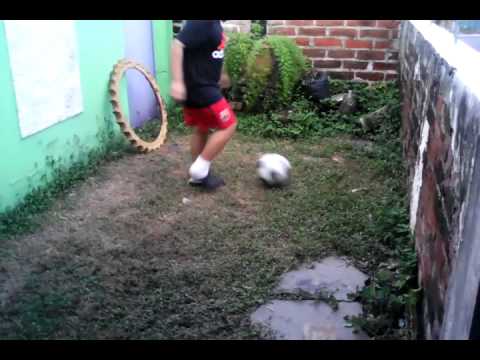
Where is `sock`? The width and height of the screenshot is (480, 360). sock is located at coordinates (202, 166).